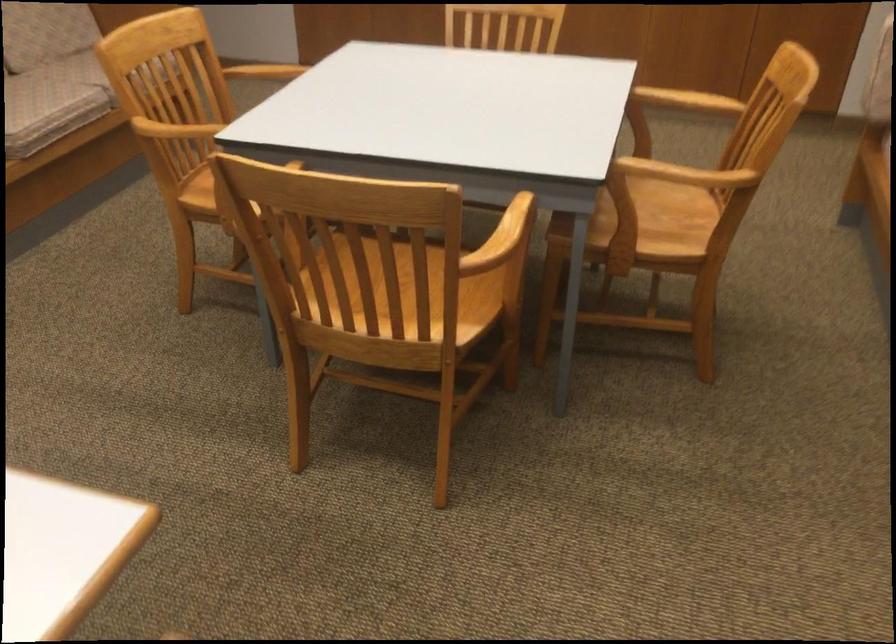
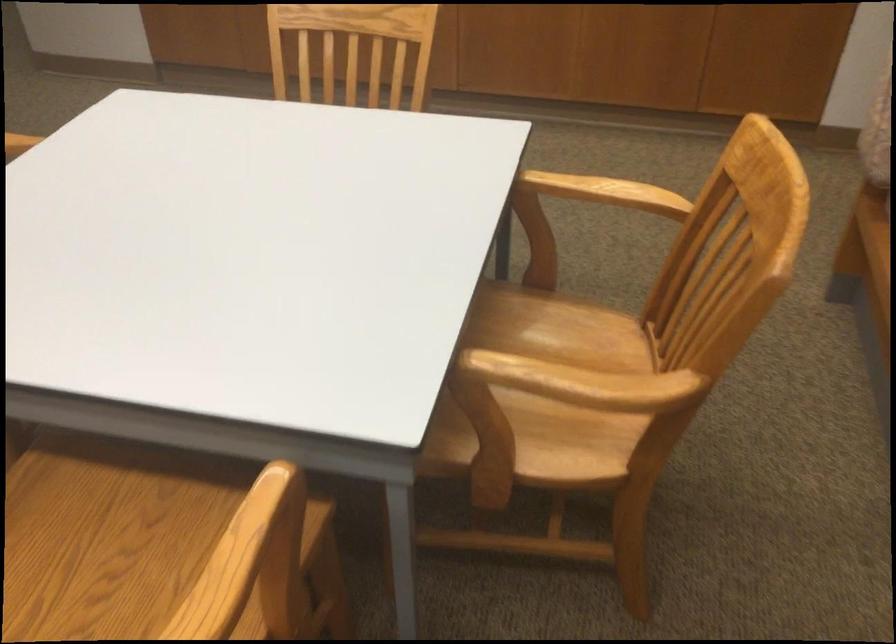
Locate, in the second image, the point that corresponds to pixel 686 167 in the first image.

(583, 383)